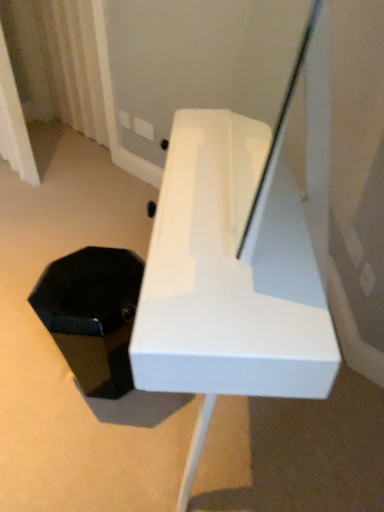
Question: Would you say white sheer curtain at upper left is to the left or to the right of black matte hexagonal box at lower left in the picture?

Choices:
 (A) left
 (B) right

Answer: (A)

Question: Do you think white sheer curtain at upper left is within black matte hexagonal box at lower left, or outside of it?

Choices:
 (A) inside
 (B) outside

Answer: (B)

Question: Which is nearer to the white sheer curtain at upper left?

Choices:
 (A) black matte hexagonal box at lower left
 (B) white glossy bench at center

Answer: (A)

Question: Considering the real-world distances, which object is farthest from the white sheer curtain at upper left?

Choices:
 (A) black matte hexagonal box at lower left
 (B) white glossy bench at center

Answer: (B)